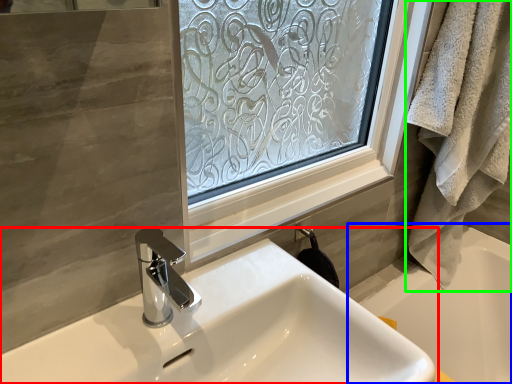
Question: Based on their relative distances, which object is farther from sink (highlighted by a red box)? Choose from bath (highlighted by a blue box) and bath towel (highlighted by a green box).

Choices:
 (A) bath
 (B) bath towel

Answer: (A)